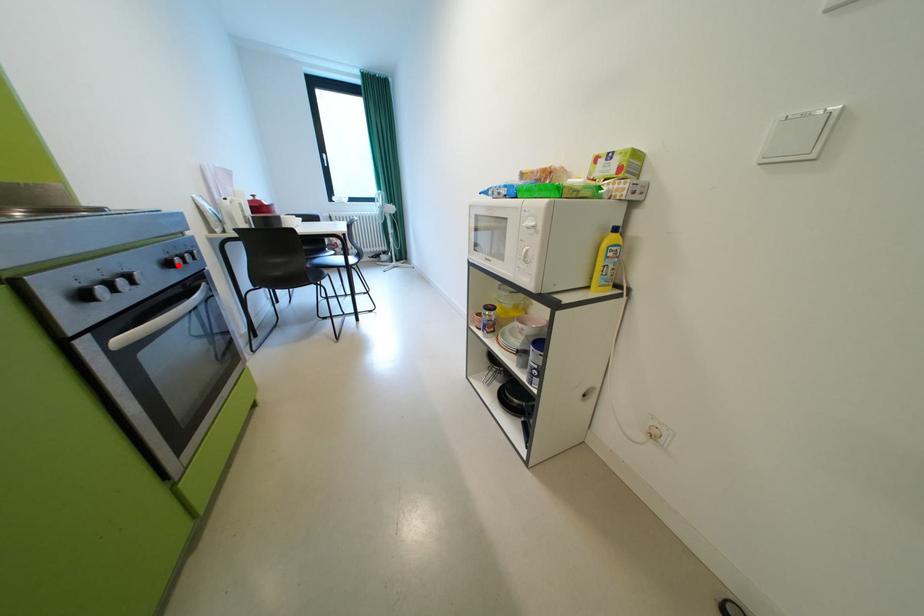
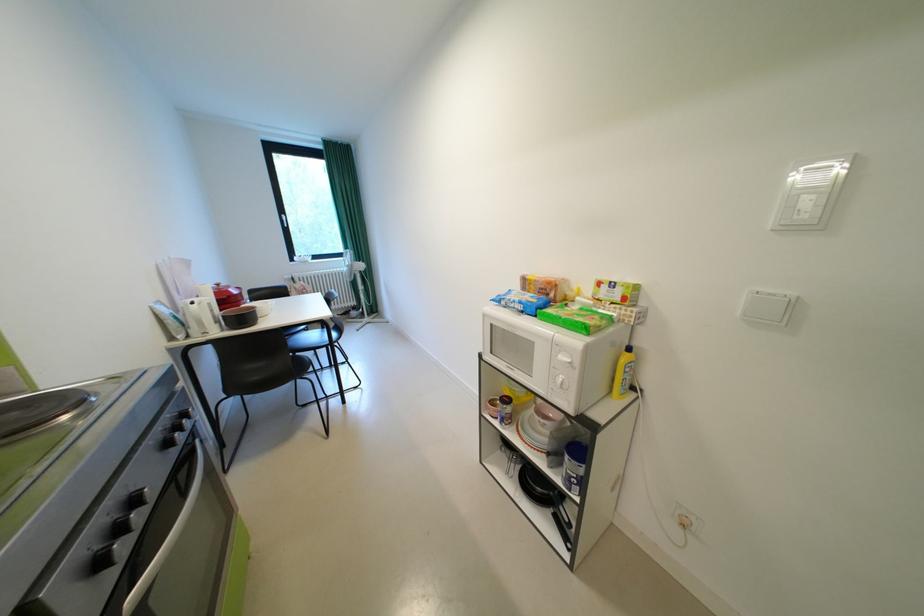
Find the pixel in the second image that matches the highlighted location in the first image.

(176, 446)